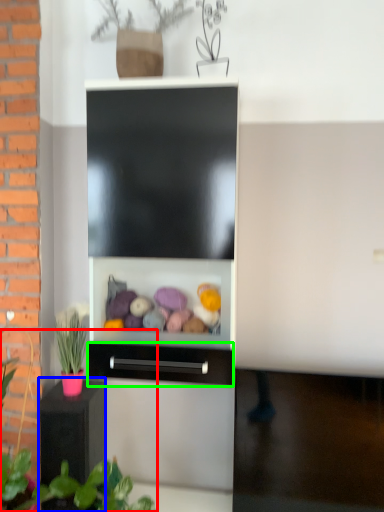
Question: Which object is positioned closest to plant (highlighted by a red box)? Select from furniture (highlighted by a blue box) and drawer (highlighted by a green box).

Choices:
 (A) furniture
 (B) drawer

Answer: (A)